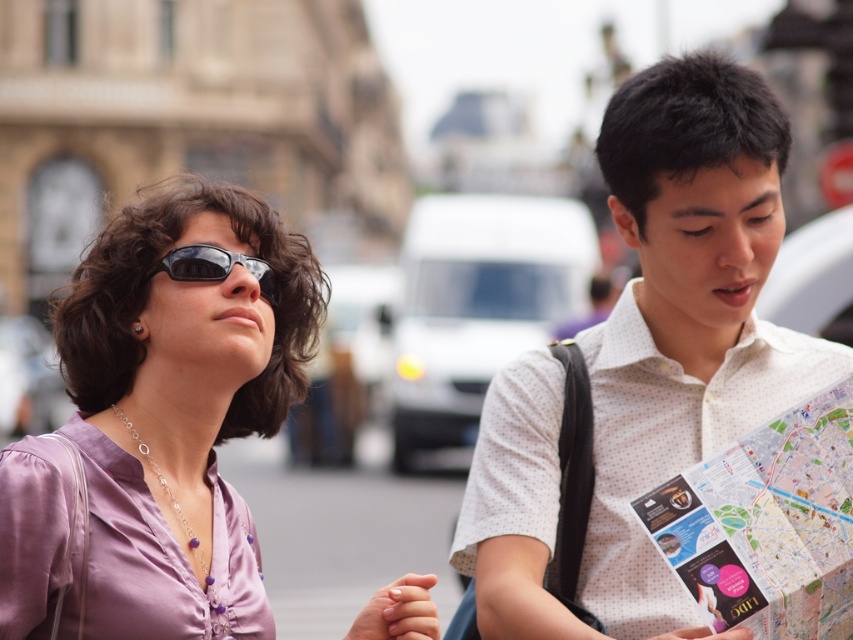
Question: Is paper map at center positioned in front of matte black sunglasses at upper left?

Choices:
 (A) yes
 (B) no

Answer: (A)

Question: Estimate the real-world distances between objects in this image. Which object is closer to the matte black sunglasses at upper left?

Choices:
 (A) purple satin blouse at left
 (B) paper map at center

Answer: (A)

Question: Estimate the real-world distances between objects in this image. Which object is farther from the purple satin blouse at left?

Choices:
 (A) matte black sunglasses at upper left
 (B) paper map at center

Answer: (B)

Question: Does white dotted shirt at center have a larger size compared to paper map at center?

Choices:
 (A) no
 (B) yes

Answer: (B)

Question: Which point is closer to the camera taking this photo?

Choices:
 (A) (106, 378)
 (B) (196, 276)

Answer: (B)

Question: Can you confirm if white dotted shirt at center is positioned to the left of purple satin blouse at left?

Choices:
 (A) no
 (B) yes

Answer: (A)